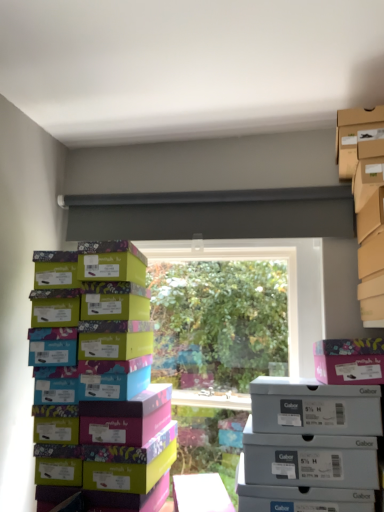
Question: Considering the positions of gray matte shoebox at lower right, positioned as the 1th storage box in bottom-to-top order, and pink cardboard box at upper right in the image, is gray matte shoebox at lower right, positioned as the 1th storage box in bottom-to-top order, taller or shorter than pink cardboard box at upper right?

Choices:
 (A) short
 (B) tall

Answer: (B)

Question: Based on their sizes in the image, would you say gray matte shoebox at lower right, the second storage box positioned from the top, is bigger or smaller than pink cardboard box at upper right?

Choices:
 (A) small
 (B) big

Answer: (B)

Question: Estimate the real-world distances between objects in this image. Which object is closer to the cardboard shoebox at upper right, placed as the 1th storage box when sorted from top to bottom?

Choices:
 (A) pink cardboard box at upper right
 (B) gray matte shoebox at lower right, the second storage box positioned from the top
 (C) multicolored cardboard shoebox at left

Answer: (A)

Question: Which of these objects is positioned closest to the pink cardboard box at upper right?

Choices:
 (A) multicolored cardboard shoebox at left
 (B) gray matte shoebox at lower right, positioned as the 1th storage box in bottom-to-top order
 (C) cardboard shoebox at upper right, placed as the 1th storage box when sorted from top to bottom

Answer: (B)